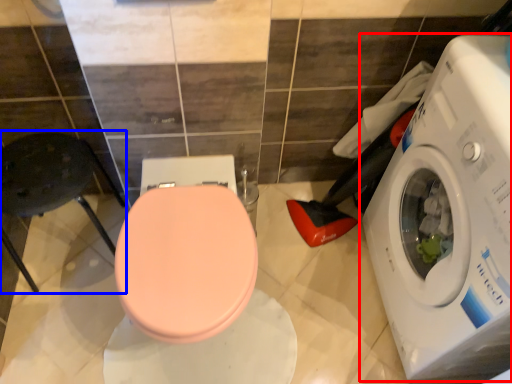
Question: Among these objects, which one is farthest to the camera, washing machine (highlighted by a red box) or chair (highlighted by a blue box)?

Choices:
 (A) washing machine
 (B) chair

Answer: (B)